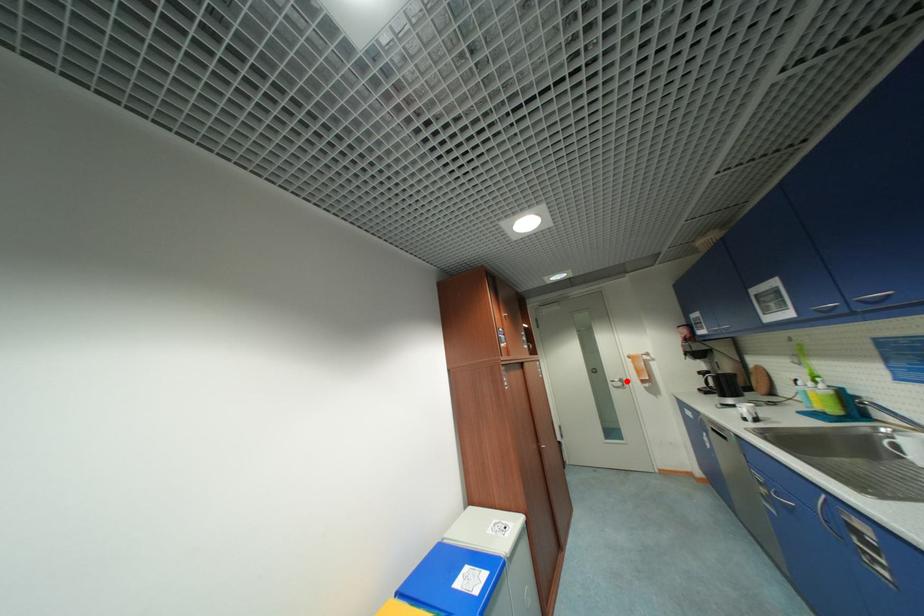
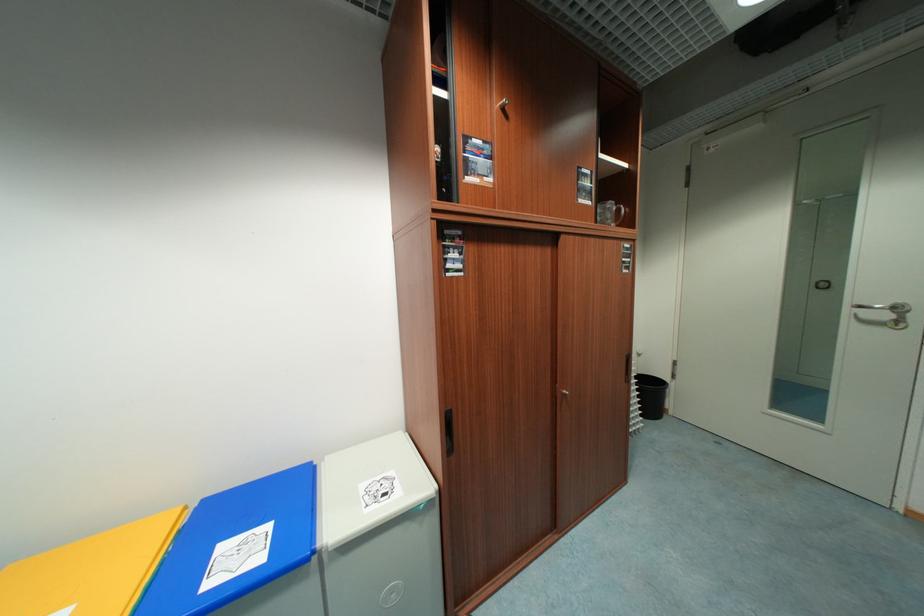
Locate, in the second image, the point that corresponds to the highlighted location in the first image.

(904, 310)